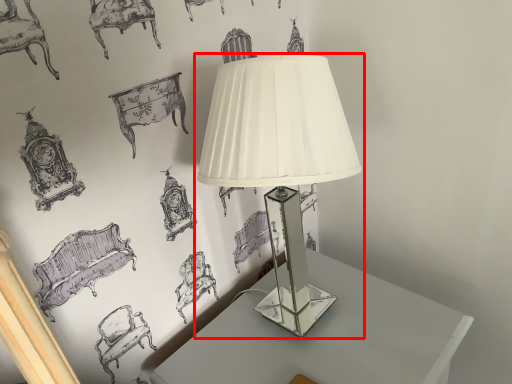
Question: From the image's perspective, where is lamp (annotated by the red box) located relative to table?

Choices:
 (A) below
 (B) above

Answer: (B)